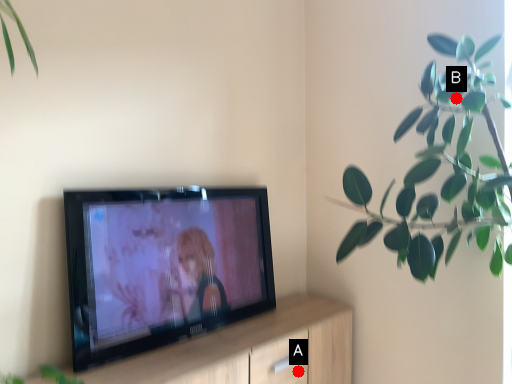
Question: Two points are circled on the image, labeled by A and B beside each circle. Which point is closer to the camera?

Choices:
 (A) A is closer
 (B) B is closer

Answer: (B)